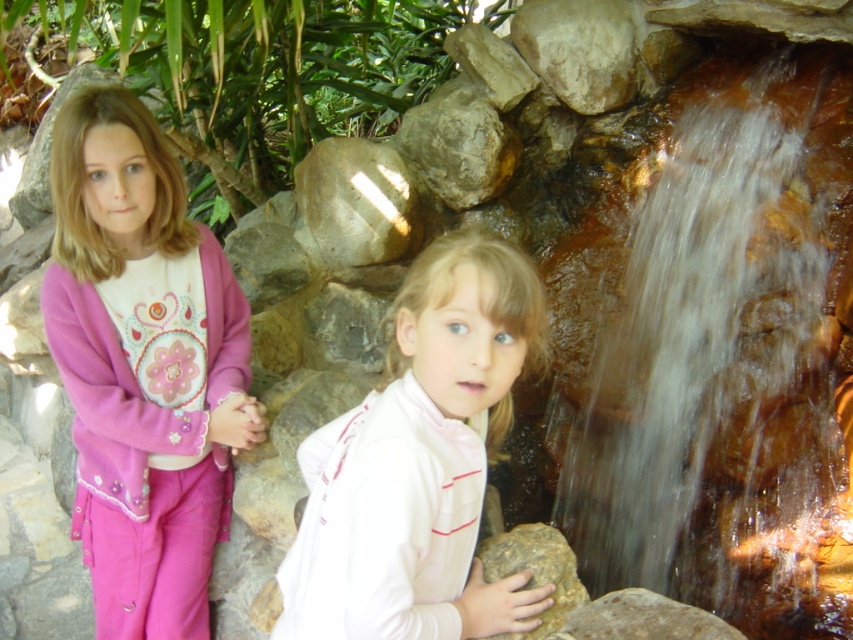
Based on the photo, you are a hiker who wants to cross the waterfall area. You see the translucent wet rock at right and the pink fleece sweater at left. Which object can you use to step on to cross safely?

The translucent wet rock at right can be used to step on to cross safely since it has a larger size compared to the pink fleece sweater at left, making it more stable for footing.